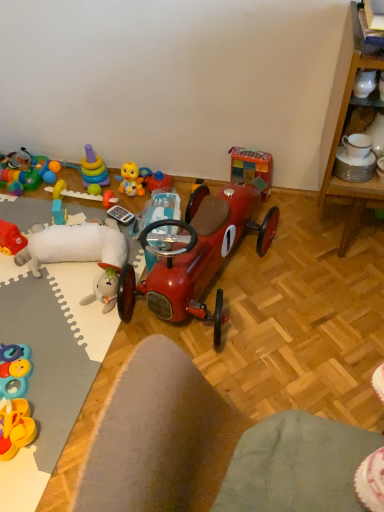
Where is `unoccupied area in front of shiny red car at center, which is the 10th toy in left-to-right order`? unoccupied area in front of shiny red car at center, which is the 10th toy in left-to-right order is located at coordinates (261, 367).